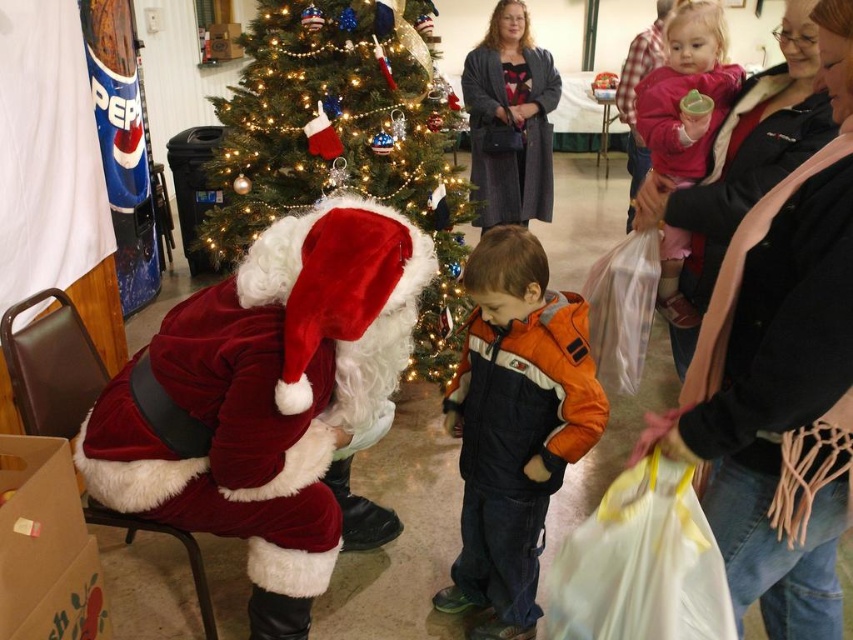
Question: Considering the real-world distances, which object is closest to the orange fleece jacket at center?

Choices:
 (A) shiny green christmas tree at center
 (B) brown paper box at lower left

Answer: (B)

Question: Is velvet santa at left smaller than brown paper box at lower left?

Choices:
 (A) no
 (B) yes

Answer: (A)

Question: Does velvet santa at left appear over pink fleece jacket at upper right?

Choices:
 (A) no
 (B) yes

Answer: (A)

Question: Estimate the real-world distances between objects in this image. Which object is closer to the velvet santa at left?

Choices:
 (A) shiny green christmas tree at center
 (B) orange fleece jacket at center

Answer: (B)

Question: Estimate the real-world distances between objects in this image. Which object is closer to the shiny green christmas tree at center?

Choices:
 (A) velvet santa at left
 (B) brown paper box at lower left

Answer: (A)

Question: Does velvet santa at left appear over shiny green christmas tree at center?

Choices:
 (A) no
 (B) yes

Answer: (A)